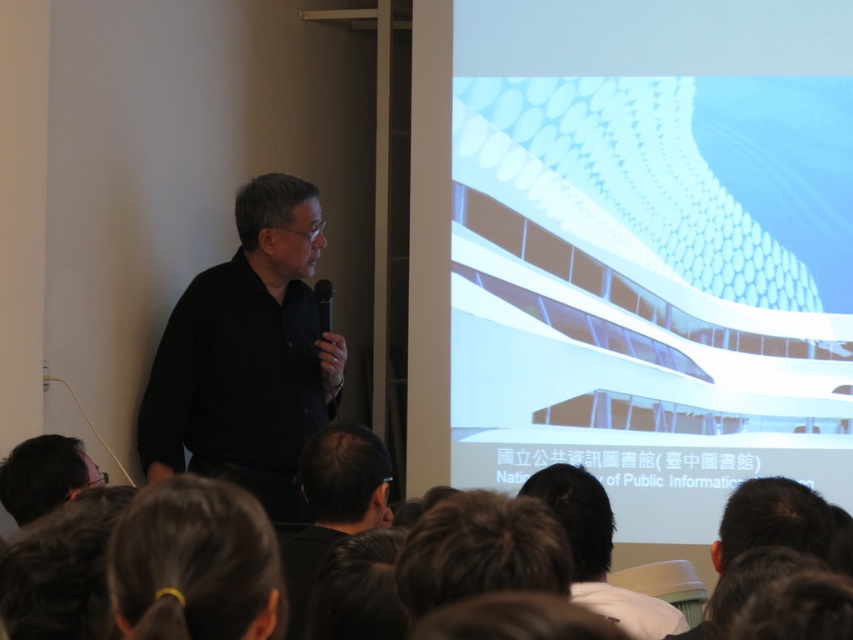
Question: Does black matte shirt at center have a greater width compared to dark brown hair at lower left?

Choices:
 (A) no
 (B) yes

Answer: (B)

Question: Can you confirm if dark brown hair at lower left is thinner than black matte shirt at lower center?

Choices:
 (A) yes
 (B) no

Answer: (A)

Question: Is black matte shirt at lower center closer to camera compared to black matte microphone at center?

Choices:
 (A) no
 (B) yes

Answer: (B)

Question: Which of these objects is positioned closest to the black matte shirt at center?

Choices:
 (A) dark brown hair at lower left
 (B) black matte microphone at center
 (C) white matte building at upper right
 (D) black matte shirt at lower center

Answer: (B)

Question: Which point is farther to the camera?

Choices:
 (A) (328, 541)
 (B) (535, 234)
 (C) (16, 481)
 (D) (155, 545)

Answer: (B)

Question: Which point is farther from the camera taking this photo?

Choices:
 (A) (270, 595)
 (B) (76, 440)

Answer: (B)